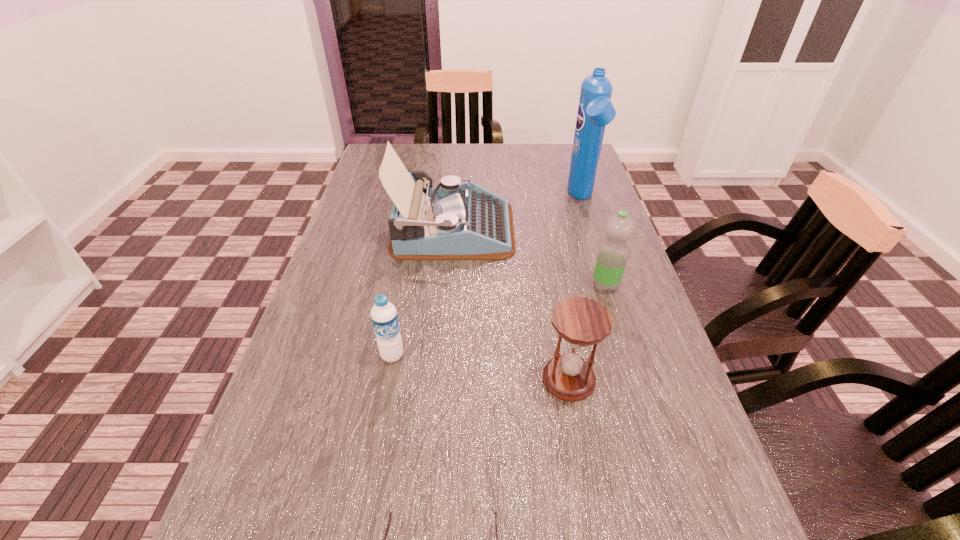
Identify the location of vacant position in the image that satisfies the following two spatial constraints: 1. on the typing side of the typewriter; 2. on the right side of the hourglass. (442, 379).

What are the coordinates of `free space in the image that satisfies the following two spatial constraints: 1. on the typing side of the typewriter; 2. on the right side of the taller water bottle` in the screenshot? It's located at (449, 285).

Where is `vacant region that satisfies the following two spatial constraints: 1. on the typing side of the typewriter; 2. on the left side of the fourth object from left to right`? The width and height of the screenshot is (960, 540). vacant region that satisfies the following two spatial constraints: 1. on the typing side of the typewriter; 2. on the left side of the fourth object from left to right is located at coordinates (442, 379).